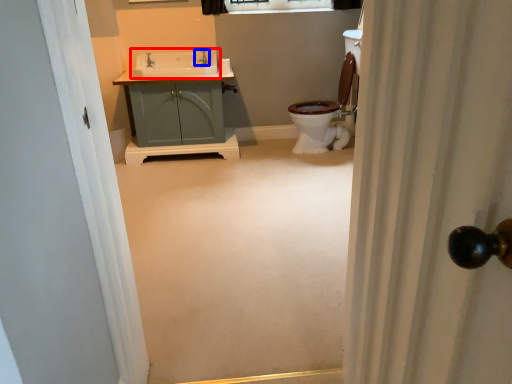
Question: Which point is further to the camera, sink (highlighted by a red box) or tap (highlighted by a blue box)?

Choices:
 (A) sink
 (B) tap

Answer: (B)